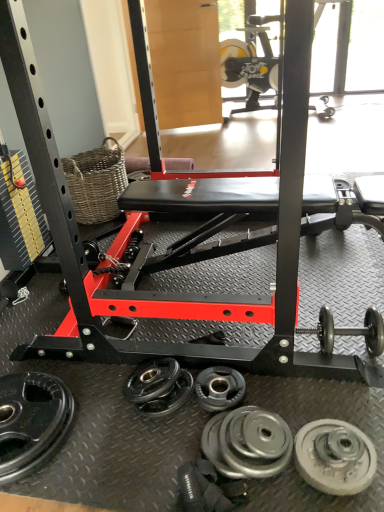
The width and height of the screenshot is (384, 512). I want to click on blank space to the left of silver metallic weight plate at lower center, which ranks as the third wheel in left-to-right order, so click(x=173, y=453).